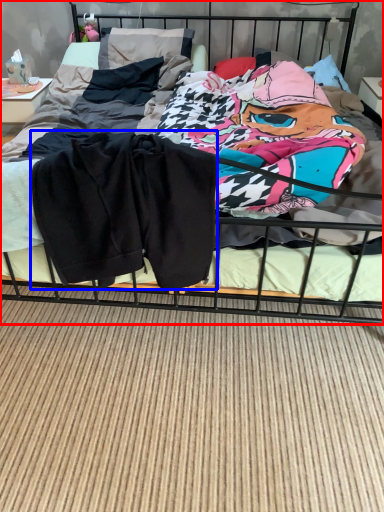
Question: Which of the following is the farthest to the observer, bed (highlighted by a red box) or baby clothe (highlighted by a blue box)?

Choices:
 (A) bed
 (B) baby clothe

Answer: (B)